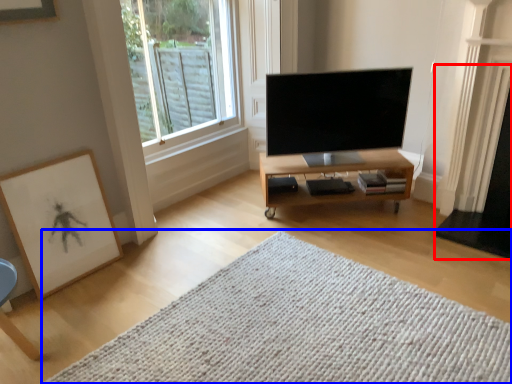
Question: Which of the following is the closest to the observer, fireplace (highlighted by a red box) or mat (highlighted by a blue box)?

Choices:
 (A) fireplace
 (B) mat

Answer: (B)